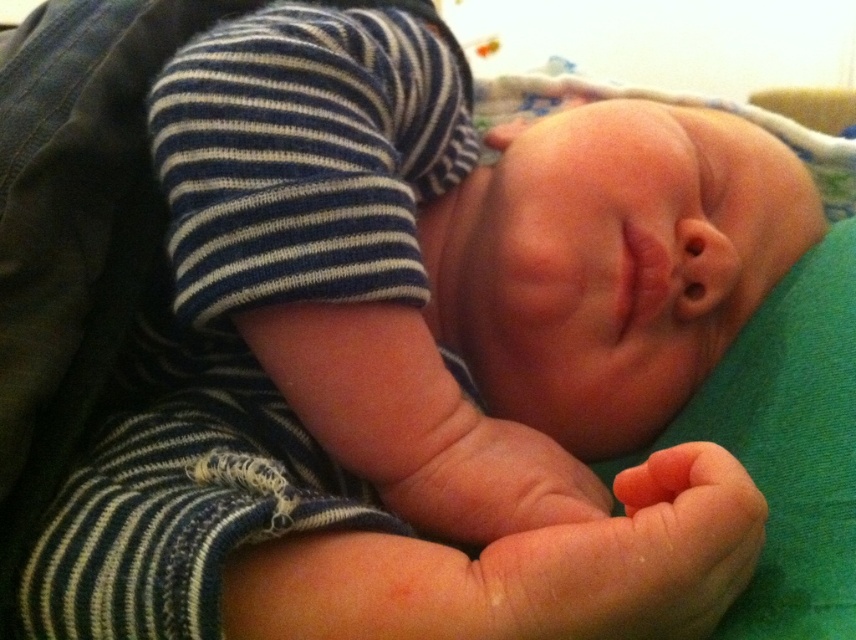
You are a photographer adjusting lighting for a baby photo shoot. You need to ensure the pink soft skin at center and the smooth skin hand at center are both well lit. Given their height difference, which area requires more careful lighting adjustment to avoid shadows?

The pink soft skin at center is taller than the smooth skin hand at center, so it may cast a shadow over the hand. Therefore, the smooth skin hand at center requires more careful lighting adjustment to avoid shadows caused by the taller pink soft skin at center.

You are a photographer taking closeup shots of a sleeping baby. You notice the pink soft skin at center and the smooth skin hand at center. Which of these two areas has a smaller size?

The pink soft skin at center has a smaller size compared to the smooth skin hand at center.

You are a photographer adjusting the focus of your camera. The baby is positioned in the center of the frame, and you need to ensure the pink soft skin at center is in sharp focus. What coordinates should you adjust the focus to?

You should adjust the focus to the coordinates point at point (632, 557) to ensure the pink soft skin at center is in sharp focus.